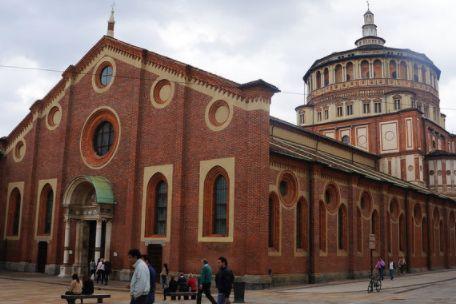
Find the location of a particular element. This screenshot has width=456, height=304. entry is located at coordinates (97, 239).